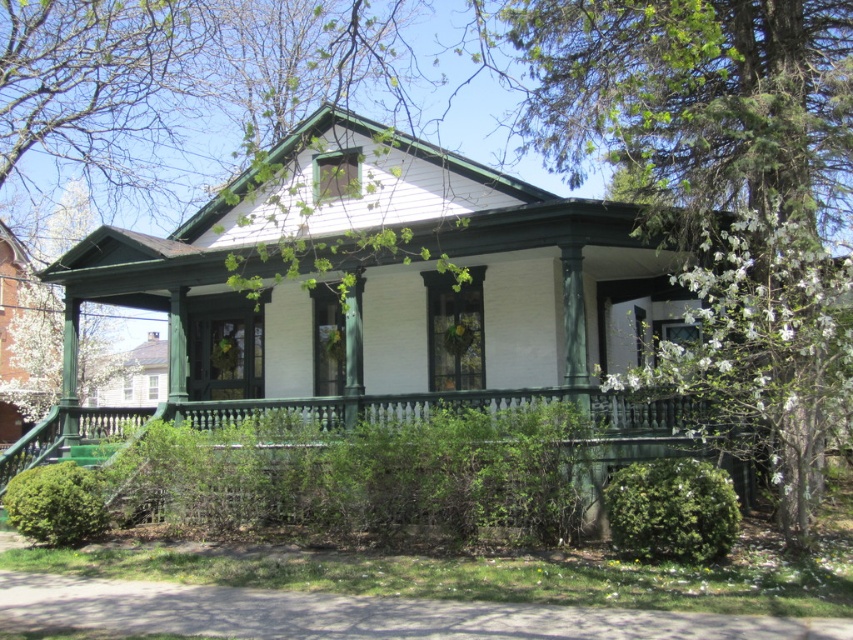
Question: Is white blossoming tree at right positioned before green painted wood porch at center?

Choices:
 (A) yes
 (B) no

Answer: (A)

Question: Is white blossoming tree at right below green painted wood porch at center?

Choices:
 (A) no
 (B) yes

Answer: (A)

Question: Does white blossoming tree at right have a greater width compared to green painted wood porch at center?

Choices:
 (A) no
 (B) yes

Answer: (A)

Question: Which point appears closest to the camera in this image?

Choices:
 (A) (786, 339)
 (B) (585, 424)

Answer: (A)

Question: Among these points, which one is nearest to the camera?

Choices:
 (A) (700, 362)
 (B) (96, 449)

Answer: (A)